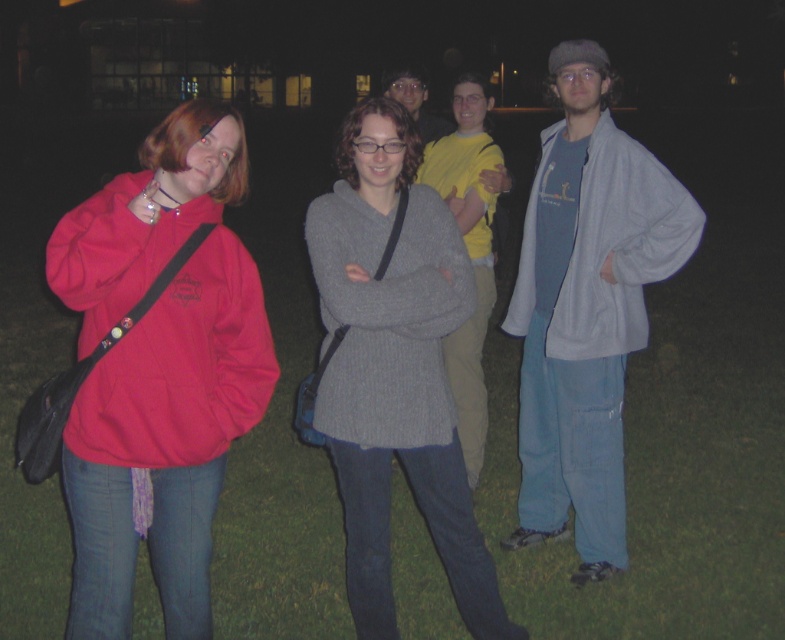
You are organizing a clothing donation drive and need to categorize the knitted gray sweater at center and the light blue fleece jacket at right based on their sizes. Which clothing item is bigger?

The knitted gray sweater at center is larger than the light blue fleece jacket at right.